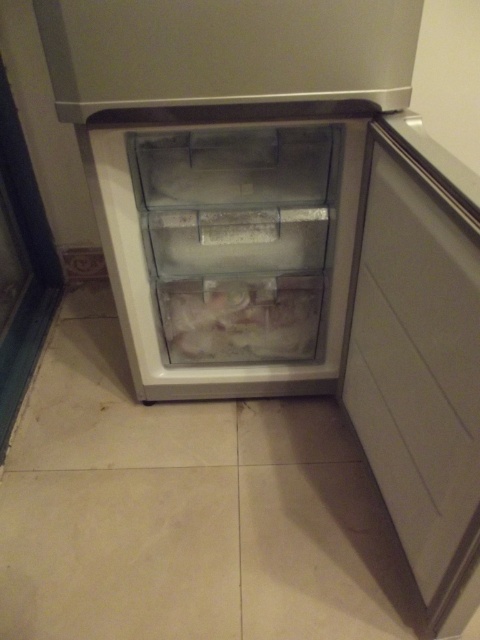
Question: Is the position of white matte door at right more distant than that of frozen white food at center?

Choices:
 (A) yes
 (B) no

Answer: (B)

Question: Is white matte door at right above frozen white food at center?

Choices:
 (A) yes
 (B) no

Answer: (B)

Question: Which of the following is the closest to the observer?

Choices:
 (A) (448, 392)
 (B) (218, 332)

Answer: (A)

Question: Does white matte door at right appear over frozen white food at center?

Choices:
 (A) yes
 (B) no

Answer: (B)